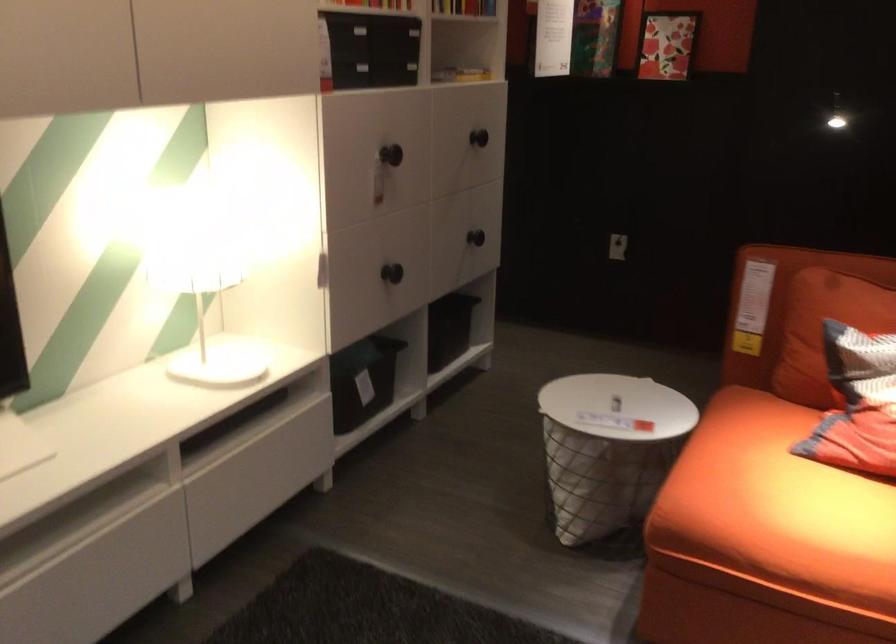
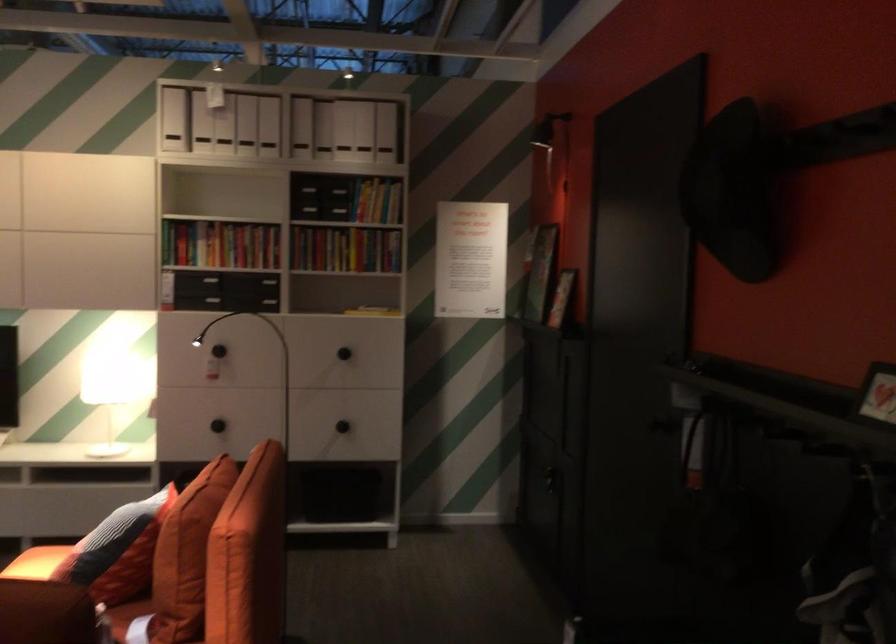
Where in the second image is the point corresponding to the point at 498,129 from the first image?

(343, 353)